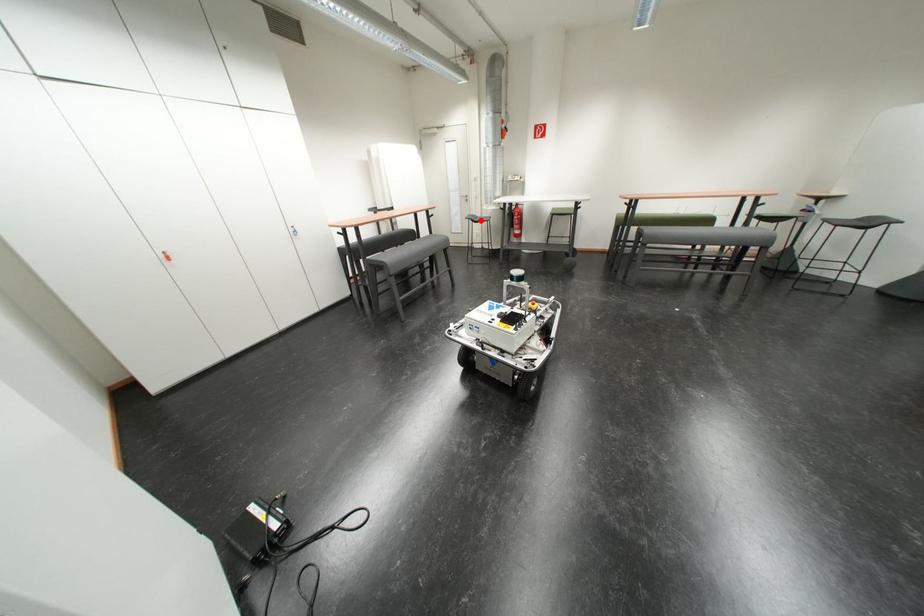
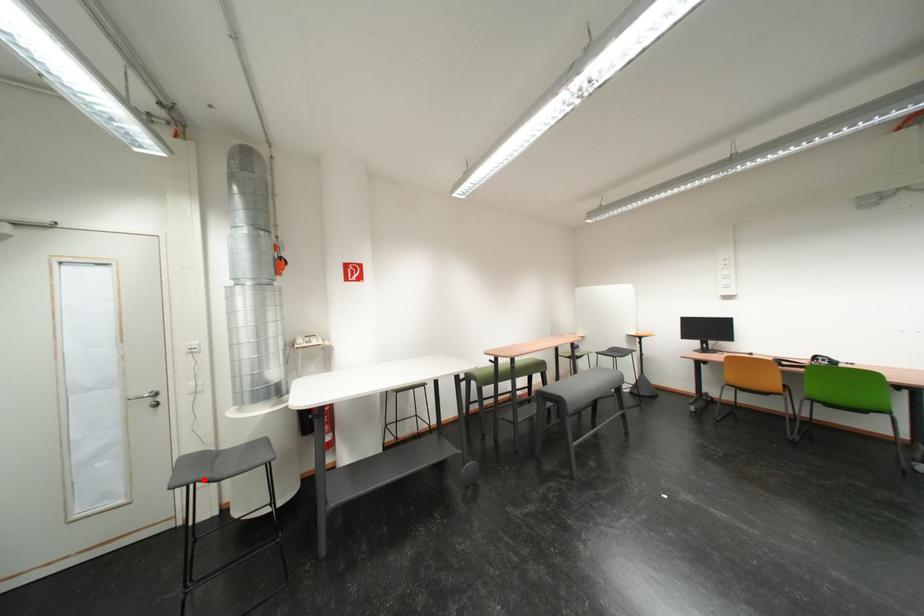
I am providing you with two images of the same scene from different viewpoints. A red point is marked on the first image and another point is marked on the second image. Is the marked point in image1 the same physical position as the marked point in image2?

Yes